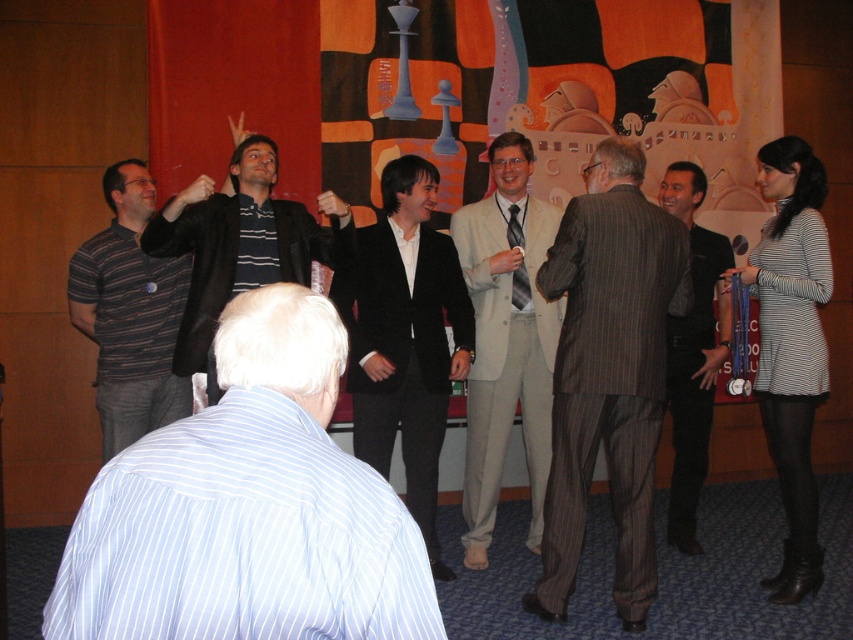
Does point (610, 260) come in front of point (422, 518)?

Yes, point (610, 260) is closer to viewer.

Does striped pinstripe suit at center have a lesser height compared to black smooth suit at center?

Incorrect, striped pinstripe suit at center's height does not fall short of black smooth suit at center's.

The image size is (853, 640). Describe the element at coordinates (608, 372) in the screenshot. I see `striped pinstripe suit at center` at that location.

The width and height of the screenshot is (853, 640). I want to click on striped pinstripe suit at center, so click(608, 372).

What do you see at coordinates (248, 508) in the screenshot?
I see `blue striped shirt at lower left` at bounding box center [248, 508].

Looking at this image, can you confirm if blue striped shirt at lower left is positioned above light beige suit at center?

Actually, blue striped shirt at lower left is below light beige suit at center.

The height and width of the screenshot is (640, 853). I want to click on blue striped shirt at lower left, so click(x=248, y=508).

Between point (94, 282) and point (695, 301), which one is positioned behind?

The point (695, 301) is behind.

Which is behind, point (186, 385) or point (689, 525)?

Positioned behind is point (689, 525).

Locate an element on the screen. The image size is (853, 640). striped cotton polo shirt at left is located at coordinates (131, 314).